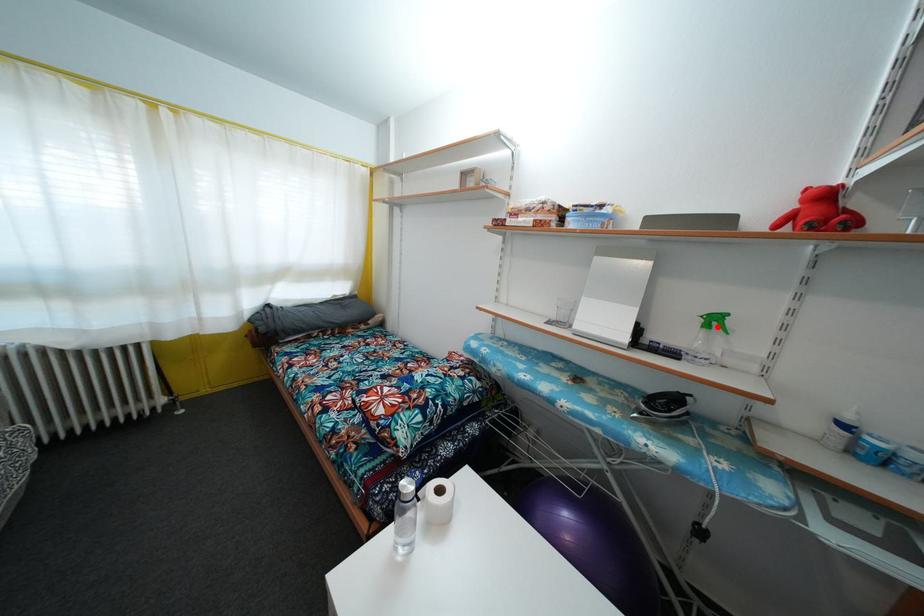
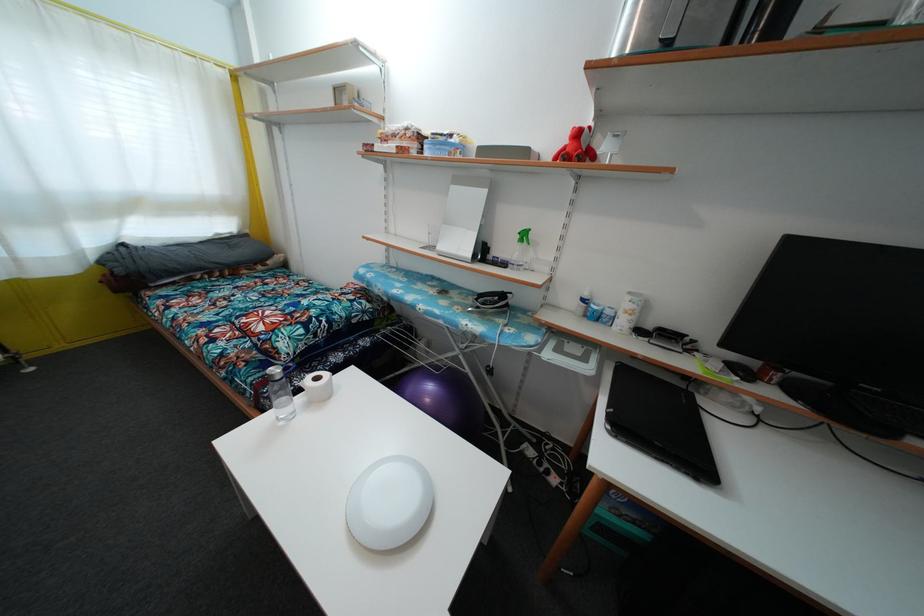
Where in the second image is the point corresponding to the highlighted location from the first image?

(528, 241)